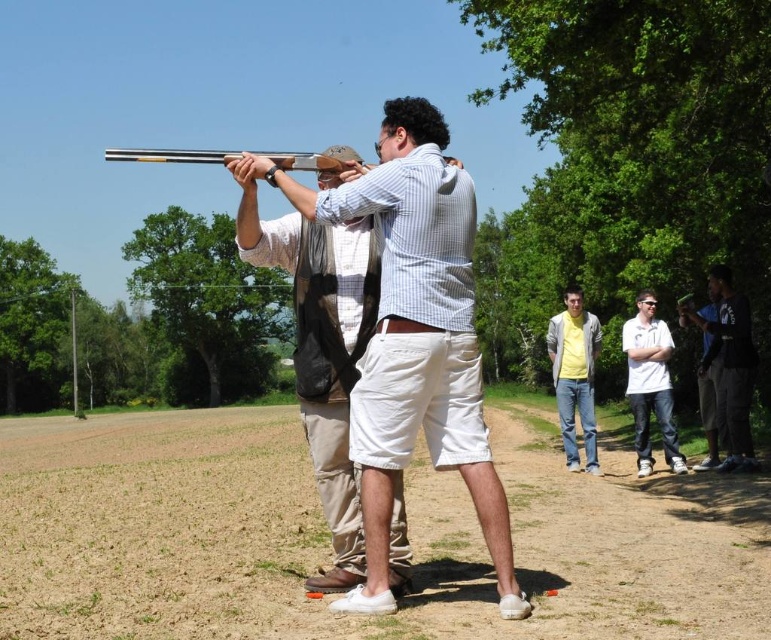
You are a safety officer ensuring participants are at least 2 meters apart during the shooting activity. Based on the scene, are the dark blue jeans at right and white matte shirt at center maintaining the required distance?

The distance between dark blue jeans at right and white matte shirt at center is 1.36 meters, which is less than the required 2 meters. They are not maintaining the required distance.

You are standing at the origin point in the image. There is an object located at point (729, 365). What is the object at that point?

The object at point (729, 365) is dark blue jeans at right.